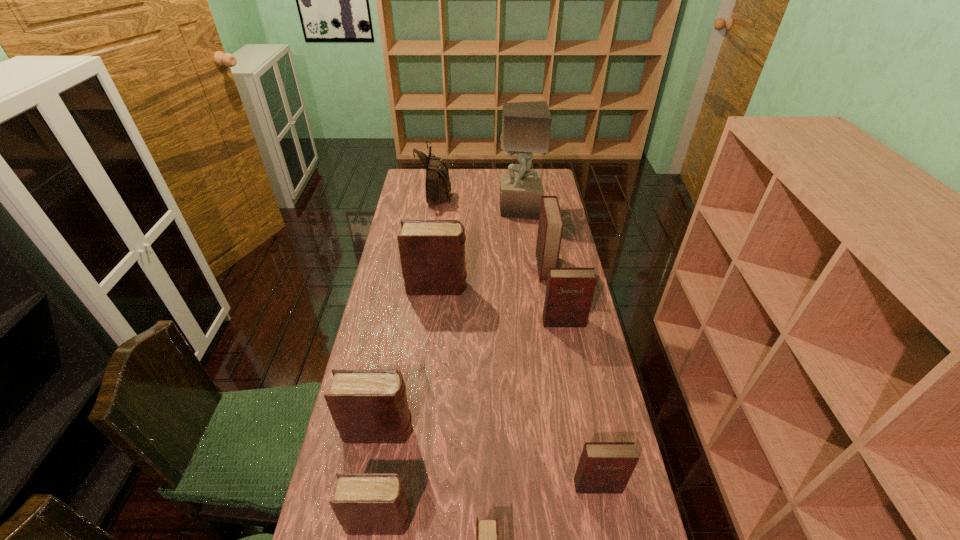
You are a GUI agent. You are given a task and a screenshot of the screen. Output one action in this format:
    pyautogui.click(x=<x>, y=<y>)
    Task: Click on the diary that is the sixth nearest to the biggest brown diary
    The image size is (960, 540).
    Given the screenshot: What is the action you would take?
    pyautogui.click(x=487, y=532)

Point out which diary is positioned as the nearest to the farthest brown diary. Please provide its 2D coordinates. Your answer should be formatted as a tuple, i.e. [(x, y)], where the tuple contains the x and y coordinates of a point satisfying the conditions above.

[(550, 228)]

Find the location of a particular element. The image size is (960, 540). reddish-brown diary that stands as the closest to the farthest brown diary is located at coordinates (550, 228).

The height and width of the screenshot is (540, 960). Find the location of `reddish-brown diary that stands as the closest to the fifth farthest diary`. reddish-brown diary that stands as the closest to the fifth farthest diary is located at coordinates (569, 292).

Select which brown diary is the second closest to the farthest brown diary. Please provide its 2D coordinates. Your answer should be formatted as a tuple, i.e. [(x, y)], where the tuple contains the x and y coordinates of a point satisfying the conditions above.

[(365, 504)]

At what (x,y) coordinates should I click in order to perform the action: click on brown diary identified as the third closest to the gray sculpture. Please return your answer as a coordinate pair (x, y). This screenshot has height=540, width=960. Looking at the image, I should click on (365, 504).